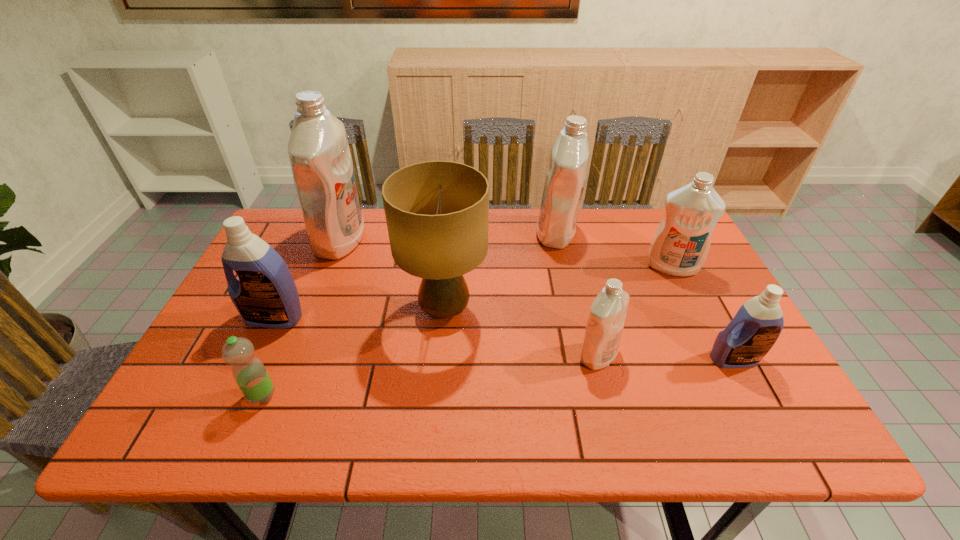
Locate which detergent is the closest to the smallest white detergent. Please provide its 2D coordinates. Your answer should be formatted as a tuple, i.e. [(x, y)], where the tuple contains the x and y coordinates of a point satisfying the conditions above.

[(755, 328)]

At what (x,y) coordinates should I click in order to perform the action: click on white detergent object that ranks as the closest to the shortest object. Please return your answer as a coordinate pair (x, y). The width and height of the screenshot is (960, 540). Looking at the image, I should click on coord(318,149).

The height and width of the screenshot is (540, 960). Identify the location of the closest white detergent relative to the nearest white detergent. (680, 245).

Find the location of a particular element. The image size is (960, 540). free space that satisfies the following two spatial constraints: 1. on the front side of the tallest detergent; 2. on the right side of the rightmost white detergent is located at coordinates (330, 267).